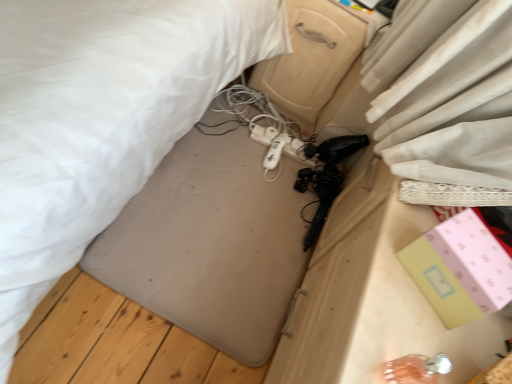
Find the location of `vacant area that is situated to the right of white plastic hairdryer at center`. vacant area that is situated to the right of white plastic hairdryer at center is located at coordinates (302, 175).